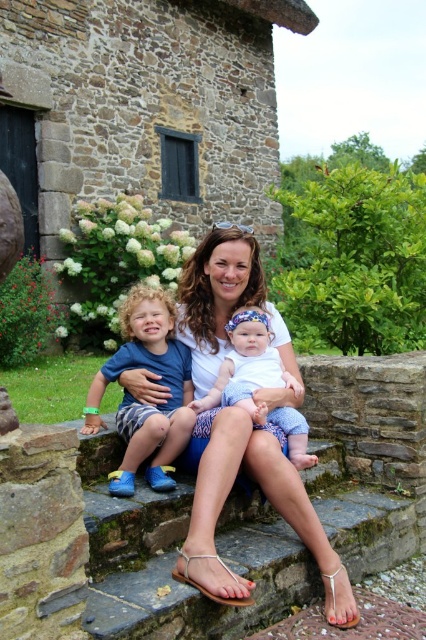
In the scene shown: Between white fabric shirt at center and blue fabric shorts at left, which one has more height?

Standing taller between the two is white fabric shirt at center.

Is point (224, 248) positioned in front of point (169, 348)?

No, (224, 248) is further to viewer.

This screenshot has height=640, width=426. What do you see at coordinates (265, 497) in the screenshot?
I see `white fabric shirt at center` at bounding box center [265, 497].

Find the location of a particular element. Image resolution: width=426 pixels, height=640 pixels. white fabric shirt at center is located at coordinates (265, 497).

Who is higher up, blue fabric shorts at left or white cotton shirt at center?

blue fabric shorts at left is above.

Consider the image. Does blue fabric shorts at left have a smaller size compared to white cotton shirt at center?

Actually, blue fabric shorts at left might be larger than white cotton shirt at center.

Locate an element on the screen. This screenshot has height=640, width=426. blue fabric shorts at left is located at coordinates (143, 403).

Which is below, white fabric shirt at center or white cotton shirt at center?

white fabric shirt at center is lower down.

Who is taller, white fabric shirt at center or white cotton shirt at center?

white fabric shirt at center

Consider the image. Who is more distant from viewer, (221, 460) or (218, 392)?

Positioned behind is point (218, 392).

This screenshot has height=640, width=426. Find the location of `white fabric shirt at center`. white fabric shirt at center is located at coordinates (265, 497).